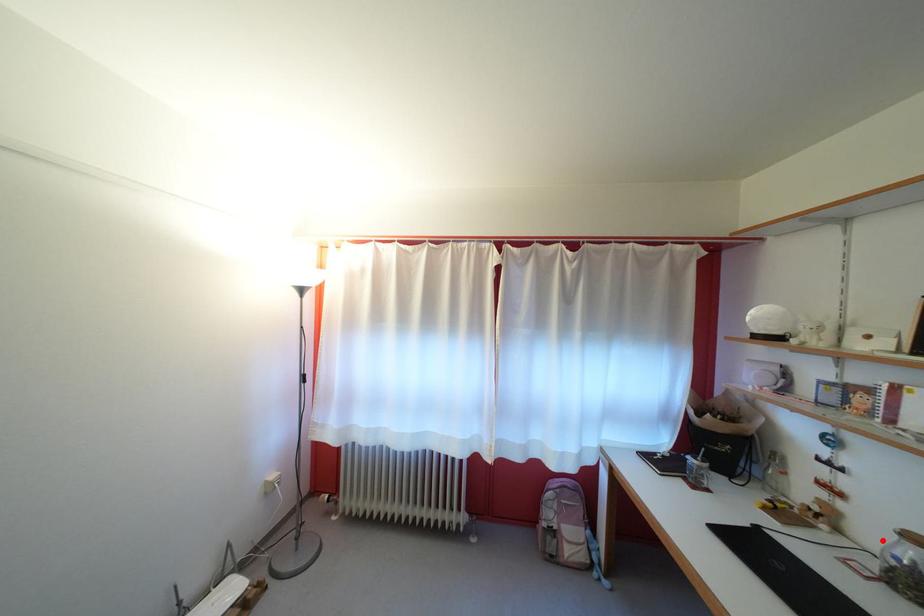
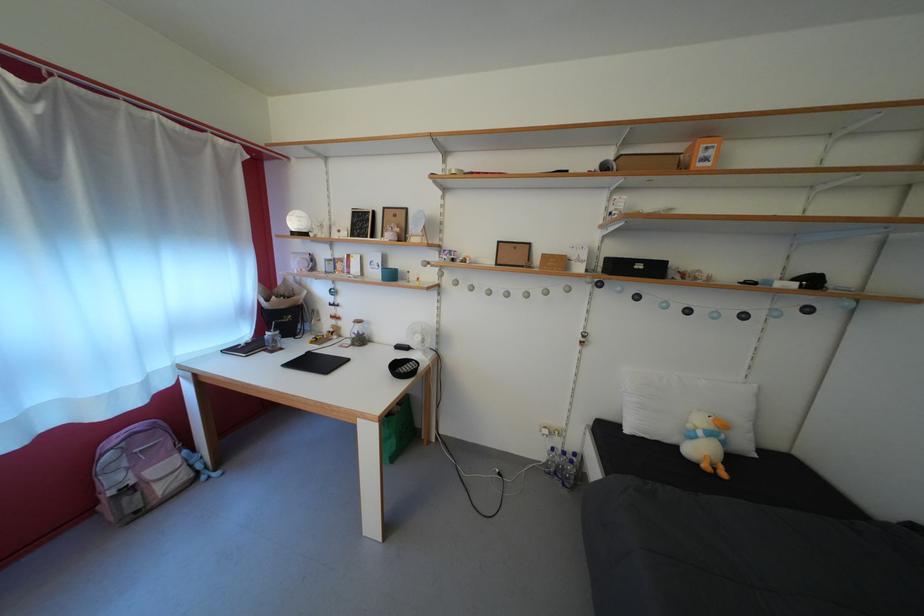
The point at the highlighted location is marked in the first image. Where is the corresponding point in the second image?

(358, 334)